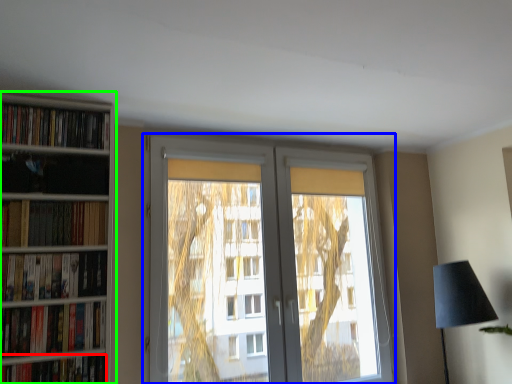
Question: Considering the real-world distances, which object is closest to book (highlighted by a red box)? window (highlighted by a blue box) or bookcase (highlighted by a green box).

Choices:
 (A) window
 (B) bookcase

Answer: (B)